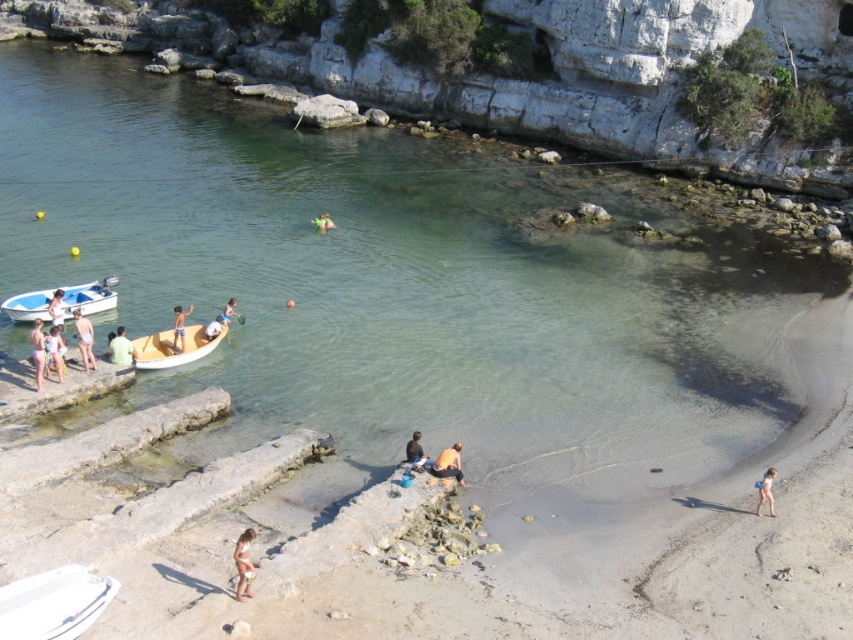
You are standing on the beach looking out at the boats in the water. There are two points marked on the image, one at coordinates point [114,355] and the other at point [314,225]. Which point is closer to you?

Point [114,355] is closer to the viewer than point [314,225].

You are standing at the point with coordinates point (219, 324) and want to walk to the point with coordinates point (59, 340). Which direction should you move to reach your destination?

To reach point (59, 340) from point (219, 324), you should move forward since point (59, 340) is in front of point (219, 324).